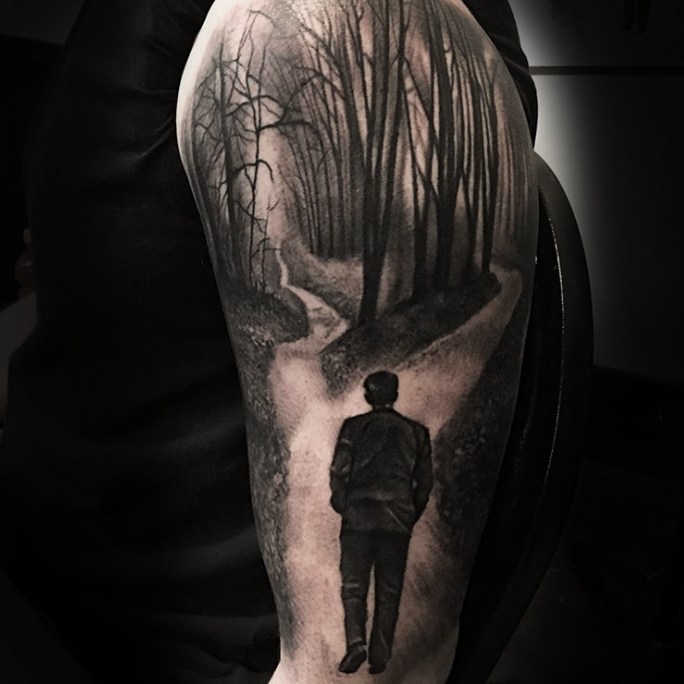
This screenshot has width=684, height=684. Find the location of `light`. light is located at coordinates (559, 139).